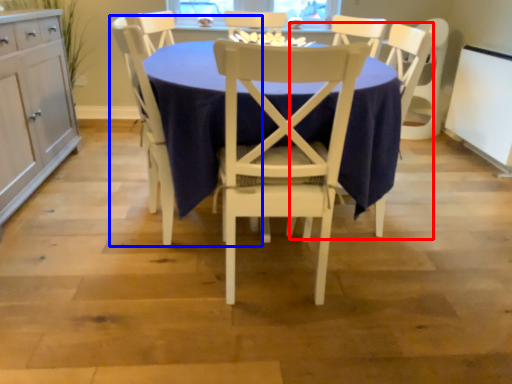
Question: Which object is closer to the camera taking this photo, armchair (highlighted by a red box) or chair (highlighted by a blue box)?

Choices:
 (A) armchair
 (B) chair

Answer: (B)